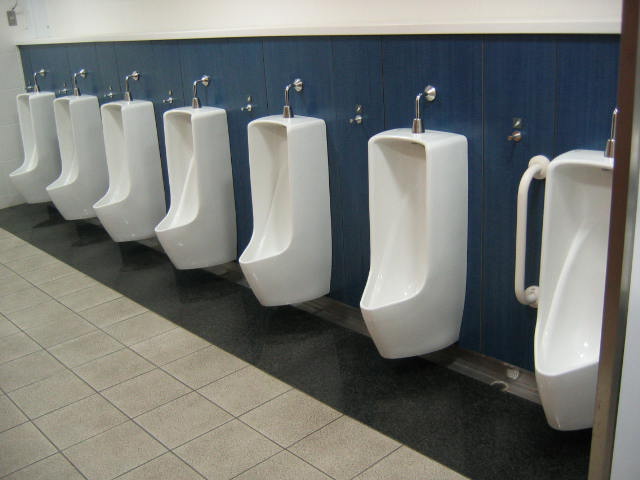
This screenshot has height=480, width=640. Identify the location of urinals. (572, 247), (403, 227), (284, 211), (188, 180), (116, 176), (72, 158), (35, 140).